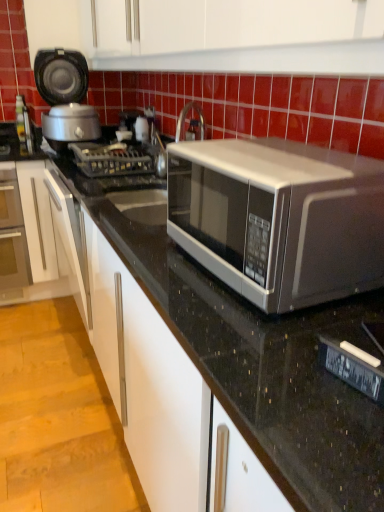
Question: Relative to matte black rice cooker at left, is satin silver microwave at center in front or behind?

Choices:
 (A) behind
 (B) front

Answer: (B)

Question: Considering the positions of satin silver microwave at center and matte black rice cooker at left in the image, is satin silver microwave at center taller or shorter than matte black rice cooker at left?

Choices:
 (A) tall
 (B) short

Answer: (B)

Question: Which is nearer to the matte black rice cooker at left?

Choices:
 (A) matte glass oven at left
 (B) satin silver microwave at center
 (C) metallic gray gas stove at center

Answer: (C)

Question: Based on their relative distances, which object is farther from the satin silver microwave at center?

Choices:
 (A) matte black rice cooker at left
 (B) matte glass oven at left
 (C) metallic gray gas stove at center

Answer: (B)